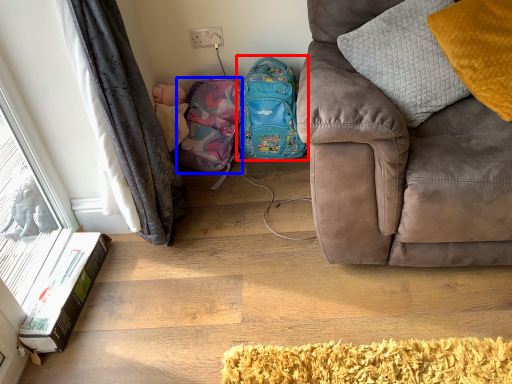
Question: Which object is further to the camera taking this photo, backpack (highlighted by a red box) or bag (highlighted by a blue box)?

Choices:
 (A) backpack
 (B) bag

Answer: (B)